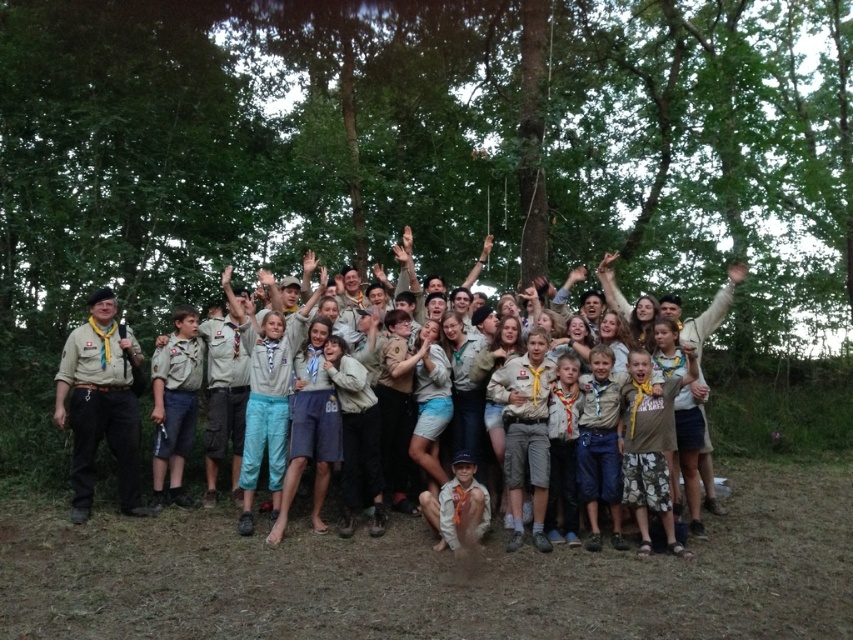
Is green leafy tree at center to the right of brown uniform at center from the viewer's perspective?

Indeed, green leafy tree at center is positioned on the right side of brown uniform at center.

In the scene shown: Does green leafy tree at center appear on the left side of brown uniform at center?

In fact, green leafy tree at center is to the right of brown uniform at center.

Consider the image. Who is more distant from viewer, (x=239, y=138) or (x=486, y=246)?

The point (x=239, y=138) is more distant.

This screenshot has width=853, height=640. I want to click on green leafy tree at center, so click(427, 150).

Which is below, brown uniform at center or matte khaki beret at left?

Positioned lower is brown uniform at center.

Between point (624, 349) and point (67, 349), which one is positioned in front?

Positioned in front is point (67, 349).

Image resolution: width=853 pixels, height=640 pixels. What are the coordinates of `brown uniform at center` in the screenshot? It's located at (705, 314).

What are the coordinates of `green leafy tree at center` in the screenshot? It's located at (427, 150).

Who is shorter, green leafy tree at center or matte khaki beret at left?

Standing shorter between the two is matte khaki beret at left.

Is point (663, 48) behind point (96, 330)?

That is True.

The height and width of the screenshot is (640, 853). Identify the location of green leafy tree at center. pos(427,150).